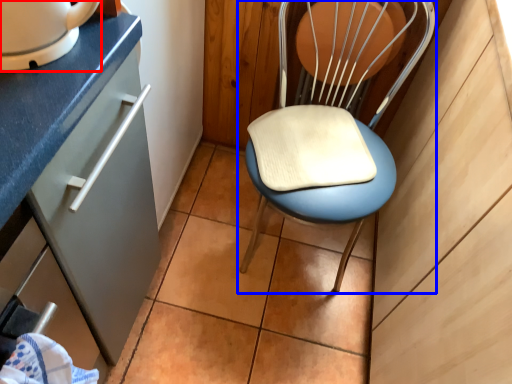
Question: Which point is further to the camera, home appliance (highlighted by a red box) or chair (highlighted by a blue box)?

Choices:
 (A) home appliance
 (B) chair

Answer: (B)